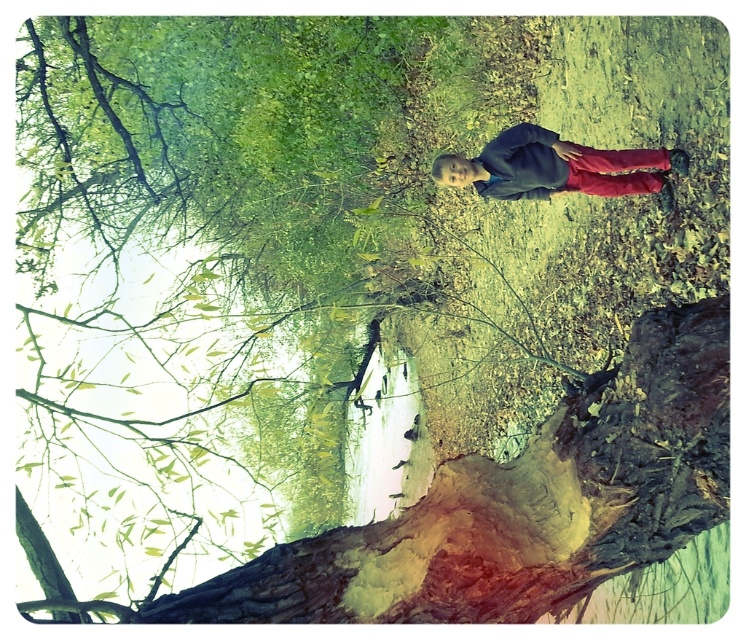
Question: Does smooth bark tree trunk at lower center have a smaller size compared to matte blue jacket at center?

Choices:
 (A) yes
 (B) no

Answer: (B)

Question: Can you confirm if smooth bark tree trunk at lower center is positioned to the right of matte blue jacket at center?

Choices:
 (A) yes
 (B) no

Answer: (B)

Question: In this image, where is smooth bark tree trunk at lower center located relative to matte blue jacket at center?

Choices:
 (A) below
 (B) above

Answer: (A)